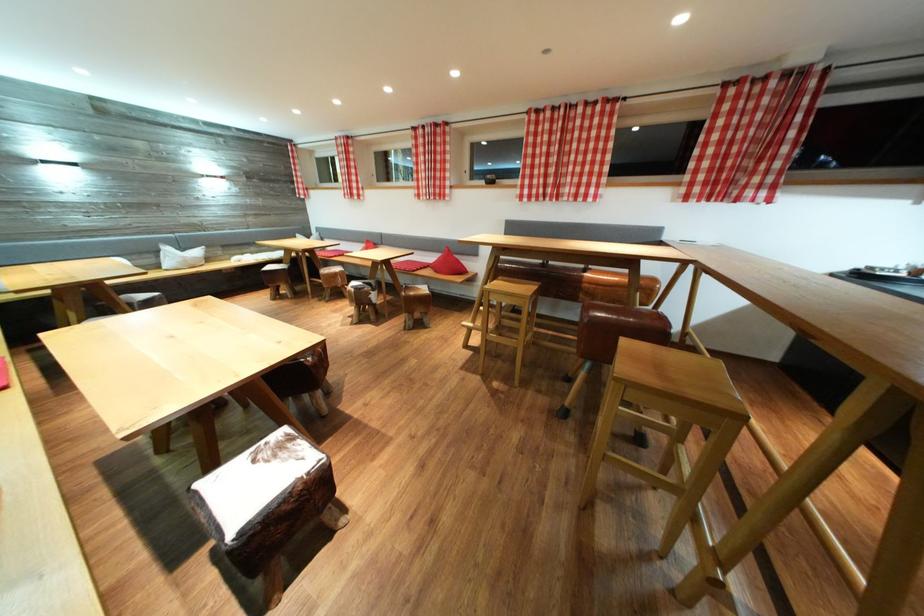
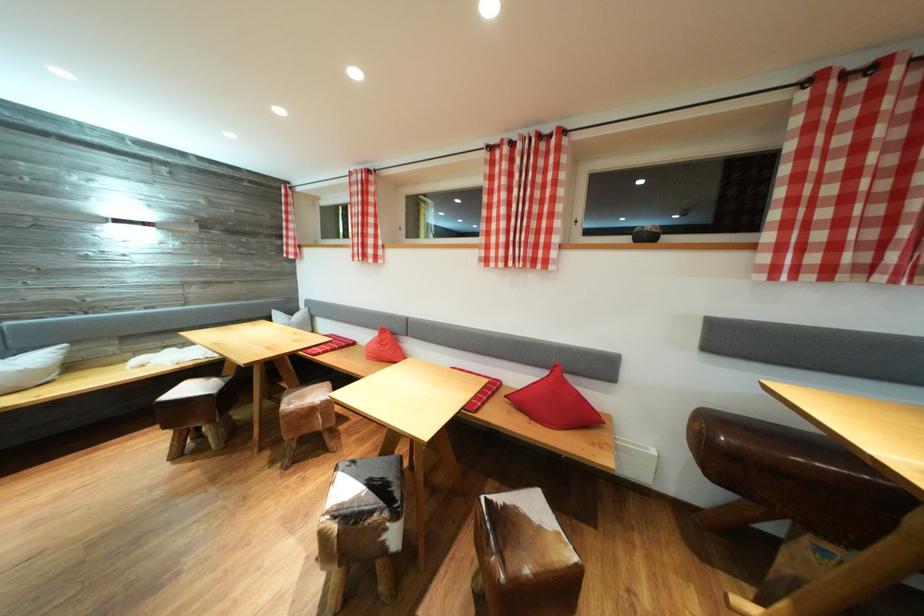
Question: I am providing you with two images of the same scene from different viewpoints. Which of the following objects are not visible in image2?

Choices:
 (A) cowhide stool seat
 (B) red triangular pillow
 (C) wooden bench surface
 (D) none of these

Answer: (D)